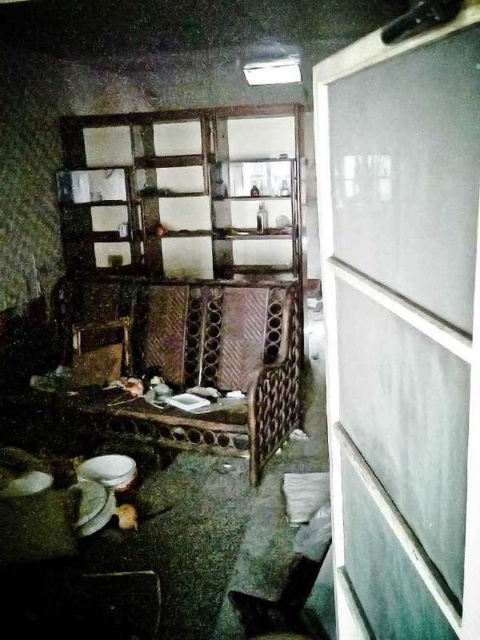
Where is `clear plastic screen door at right`? Image resolution: width=480 pixels, height=640 pixels. clear plastic screen door at right is located at coordinates (403, 328).

Can you confirm if clear plastic screen door at right is bigger than white glossy plate at lower left?

Yes.

Image resolution: width=480 pixels, height=640 pixels. I want to click on clear plastic screen door at right, so click(403, 328).

Where is `clear plastic screen door at right`? clear plastic screen door at right is located at coordinates (403, 328).

Between white glossy plate at lower left and white matte plate at lower left, which one has less height?

white matte plate at lower left is shorter.

Does white glossy plate at lower left have a lesser width compared to white matte plate at lower left?

In fact, white glossy plate at lower left might be wider than white matte plate at lower left.

Locate an element on the screen. The height and width of the screenshot is (640, 480). white glossy plate at lower left is located at coordinates (108, 470).

Is point (356, 460) behind point (3, 496)?

No, (356, 460) is in front of (3, 496).

Is clear plastic screen door at right bigger than white matte plate at lower left?

Indeed, clear plastic screen door at right has a larger size compared to white matte plate at lower left.

Does point (459, 616) come closer to viewer compared to point (6, 486)?

Yes, it is.

Locate an element on the screen. clear plastic screen door at right is located at coordinates (403, 328).